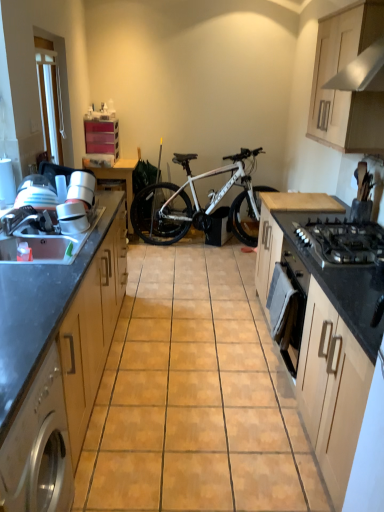
Question: Is wooden cabinet at upper right, the third cabinetry viewed from the left, positioned with its back to white glossy blender at left?

Choices:
 (A) yes
 (B) no

Answer: (B)

Question: Does wooden cabinet at upper right, the third cabinetry viewed from the left, have a lesser height compared to white glossy blender at left?

Choices:
 (A) yes
 (B) no

Answer: (B)

Question: Considering the relative sizes of wooden cabinet at upper right, the third cabinetry viewed from the left, and white glossy blender at left in the image provided, is wooden cabinet at upper right, the third cabinetry viewed from the left, smaller than white glossy blender at left?

Choices:
 (A) no
 (B) yes

Answer: (A)

Question: Is wooden cabinet at upper right, the third cabinetry viewed from the left, outside white glossy blender at left?

Choices:
 (A) yes
 (B) no

Answer: (A)

Question: Considering the relative sizes of wooden cabinet at upper right, the third cabinetry viewed from the left, and white glossy blender at left in the image provided, is wooden cabinet at upper right, the third cabinetry viewed from the left, bigger than white glossy blender at left?

Choices:
 (A) no
 (B) yes

Answer: (B)

Question: Can you confirm if wooden cabinet at upper right, the third cabinetry viewed from the left, is taller than white glossy blender at left?

Choices:
 (A) yes
 (B) no

Answer: (A)

Question: Is there a large distance between wooden table at center and white glossy blender at left?

Choices:
 (A) no
 (B) yes

Answer: (B)

Question: From the image's perspective, is wooden table at center beneath white glossy blender at left?

Choices:
 (A) no
 (B) yes

Answer: (A)

Question: Could white glossy blender at left be considered to be inside wooden table at center?

Choices:
 (A) no
 (B) yes

Answer: (A)

Question: From a real-world perspective, does wooden table at center sit lower than white glossy blender at left?

Choices:
 (A) no
 (B) yes

Answer: (B)

Question: Is wooden table at center to the right of white glossy blender at left from the viewer's perspective?

Choices:
 (A) yes
 (B) no

Answer: (B)

Question: Is the depth of wooden table at center less than that of white glossy blender at left?

Choices:
 (A) yes
 (B) no

Answer: (B)

Question: Is wooden cabinet at upper right, the third cabinetry viewed from the left, thinner than white glossy exhaust hood at upper right?

Choices:
 (A) no
 (B) yes

Answer: (B)